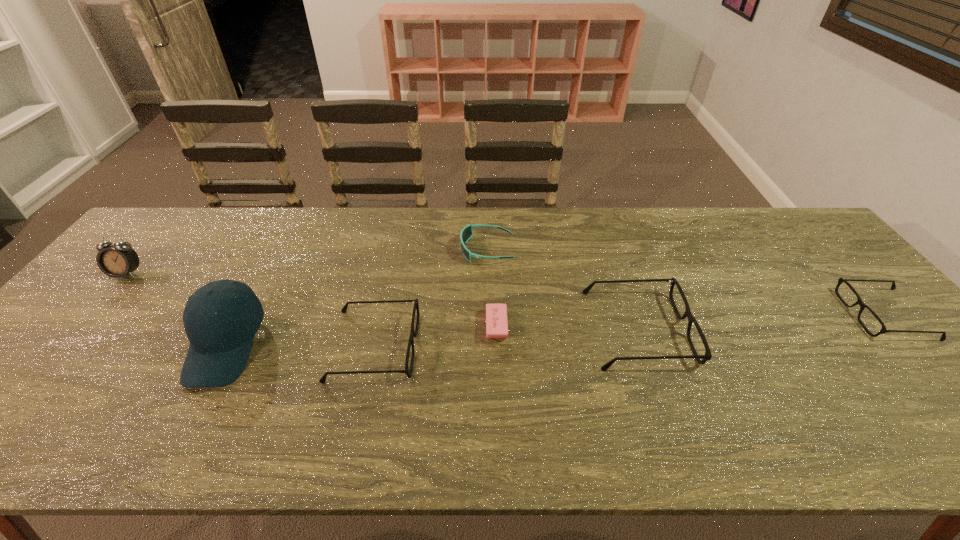
Identify the location of unoccupied position between the sixth object from right to left and the leftmost object. (177, 310).

At what (x,y) coordinates should I click in order to perform the action: click on free space between the tallest object and the eraser. Please return your answer as a coordinate pair (x, y). Looking at the image, I should click on (361, 336).

Identify the location of vacant space that is in between the second spectacles from right to left and the rightmost object. This screenshot has height=540, width=960. (761, 322).

The height and width of the screenshot is (540, 960). In order to click on vacant space that's between the sunglasses and the second spectacles from left to right in this screenshot , I will do `click(563, 289)`.

This screenshot has width=960, height=540. In order to click on free point between the eraser and the tallest object in this screenshot , I will do `click(361, 336)`.

I want to click on unoccupied area between the tallest object and the sunglasses, so click(356, 298).

Identify the location of unoccupied area between the shortest object and the baseball cap. The width and height of the screenshot is (960, 540). (361, 336).

Select which object appears as the sixth closest to the third object from left to right. Please provide its 2D coordinates. Your answer should be formatted as a tuple, i.e. [(x, y)], where the tuple contains the x and y coordinates of a point satisfying the conditions above.

[(883, 330)]

Where is `object that is the sixth nearest to the shortest spectacles`? Image resolution: width=960 pixels, height=540 pixels. object that is the sixth nearest to the shortest spectacles is located at coordinates (118, 260).

Identify the location of spectacles that stands as the second closest to the tallest object. (691, 319).